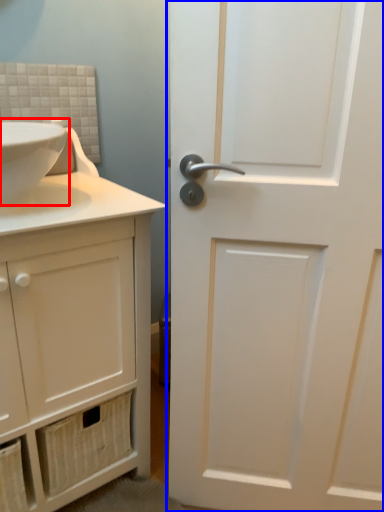
Question: Which point is closer to the camera, sink (highlighted by a red box) or door (highlighted by a blue box)?

Choices:
 (A) sink
 (B) door

Answer: (B)